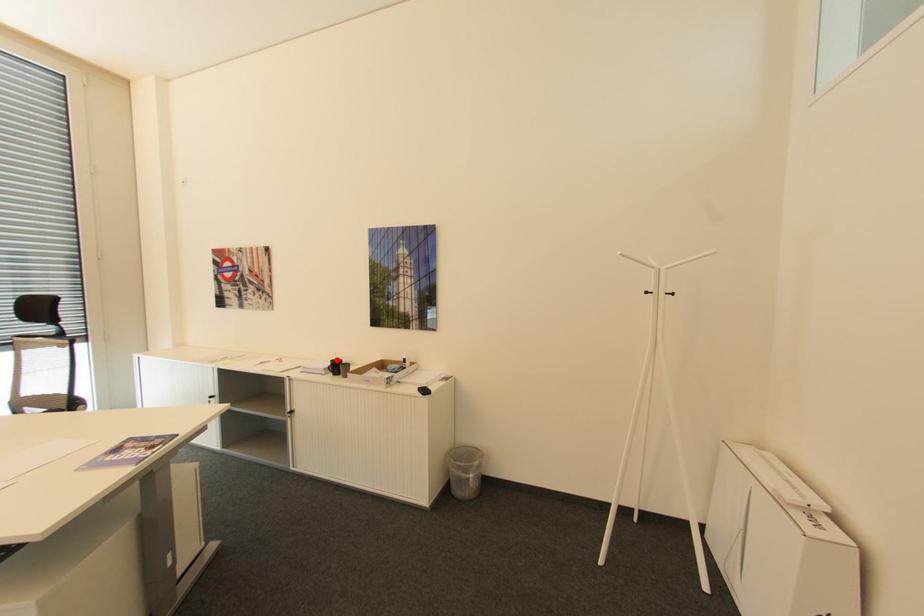
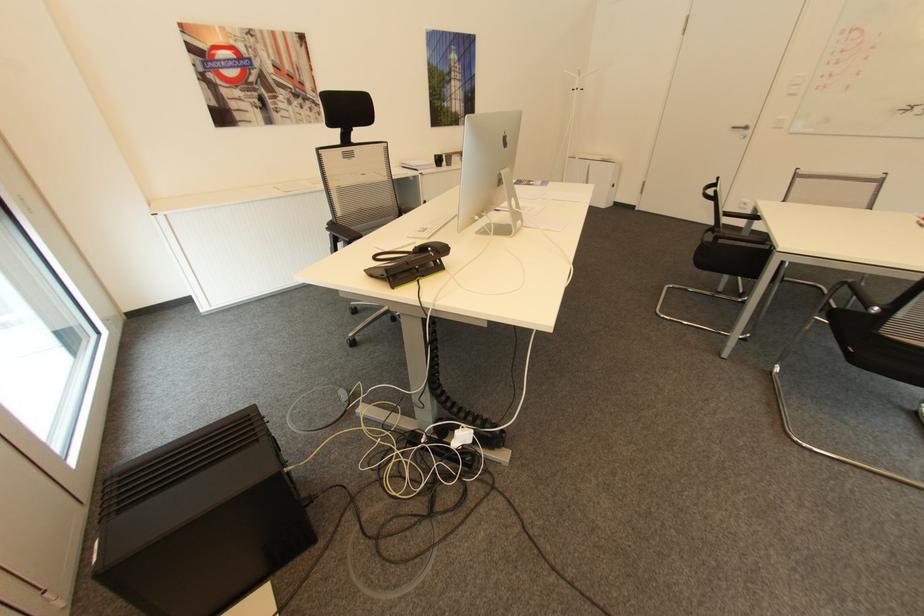
Where in the second image is the point corresponding to the highlighted location from the first image?

(441, 155)